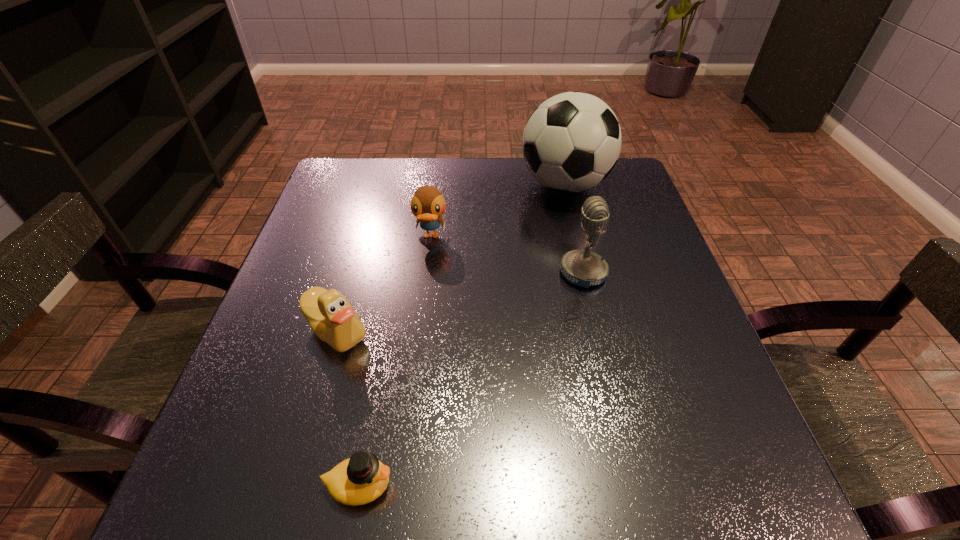
The height and width of the screenshot is (540, 960). I want to click on the second closest duck to the second farthest object, so click(361, 479).

You are a GUI agent. You are given a task and a screenshot of the screen. Output one action in this format:
    pyautogui.click(x=<x>, y=<y>)
    Task: Click on the free space that satisfies the following two spatial constraints: 1. on the front-facing side of the microphone; 2. at the beak of the second nearest object
    
    Given the screenshot: What is the action you would take?
    pyautogui.click(x=597, y=330)

Locate an element on the screen. This screenshot has width=960, height=540. vacant space that satisfies the following two spatial constraints: 1. on the front-facing side of the fourth shortest object; 2. at the beak of the second farthest duck is located at coordinates (597, 330).